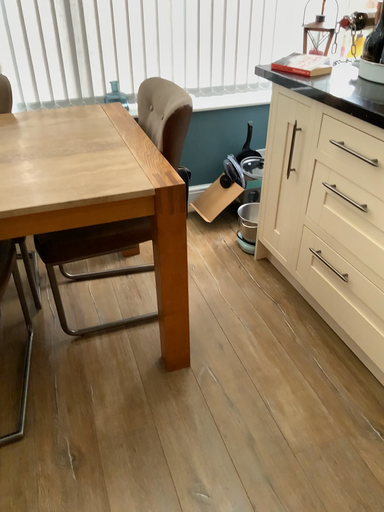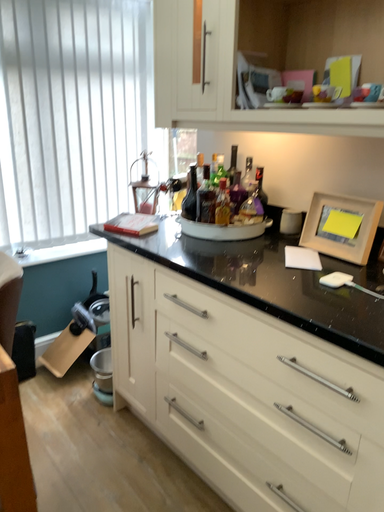
Question: Which way did the camera rotate in the video?

Choices:
 (A) rotated downward
 (B) rotated upward

Answer: (B)